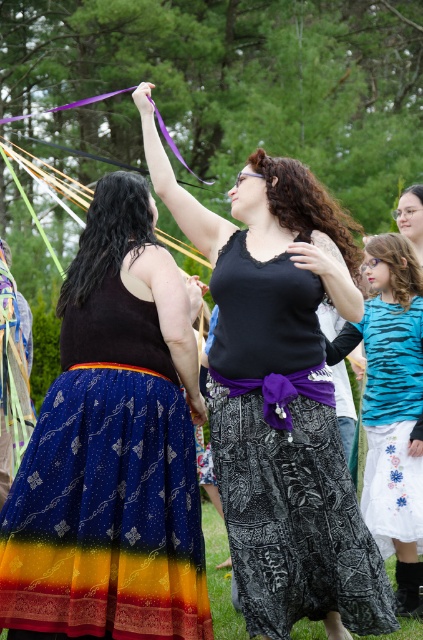
Can you confirm if black printed skirt at center is positioned to the left of blue tiger stripe shirt at center?

Indeed, black printed skirt at center is positioned on the left side of blue tiger stripe shirt at center.

Between point (238, 566) and point (348, 348), which one is positioned in front?

Point (238, 566) is more forward.

Locate an element on the screen. The image size is (423, 640). black printed skirt at center is located at coordinates point(285,456).

Does point (153, 532) come behind point (390, 236)?

No, (153, 532) is closer to viewer.

Is blue printed skirt at center closer to camera compared to blue tiger stripe shirt at center?

Yes, it is in front of blue tiger stripe shirt at center.

Consider the image. Who is more forward, (140, 384) or (400, 577)?

Positioned in front is point (140, 384).

At what (x,y) coordinates should I click in order to perform the action: click on blue printed skirt at center. Please return your answer as a coordinate pair (x, y). The height and width of the screenshot is (640, 423). Looking at the image, I should click on (112, 449).

Is point (90, 419) positioned after point (272, 570)?

That is False.

In the scene shown: Does blue printed skirt at center appear under black printed skirt at center?

Incorrect, blue printed skirt at center is not positioned below black printed skirt at center.

Which is in front, point (192, 445) or point (260, 339)?

Point (260, 339)

Locate an element on the screen. The height and width of the screenshot is (640, 423). blue printed skirt at center is located at coordinates (112, 449).